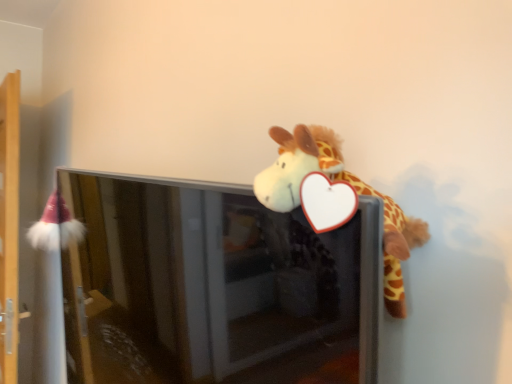
Locate an element on the screen. transparent glass screen door at upper center is located at coordinates (216, 286).

In order to face transparent glass screen door at upper center, should I rotate leftwards or rightwards?

To face it directly, rotate left by 15.056 degrees.

What do you see at coordinates (216, 286) in the screenshot? I see `transparent glass screen door at upper center` at bounding box center [216, 286].

At what (x,y) coordinates should I click in order to perform the action: click on wooden shelf at left. Please return your answer as a coordinate pair (x, y). This screenshot has height=384, width=512. Looking at the image, I should click on (9, 226).

The width and height of the screenshot is (512, 384). What do you see at coordinates (9, 226) in the screenshot? I see `wooden shelf at left` at bounding box center [9, 226].

Where is `transparent glass screen door at upper center`? The image size is (512, 384). transparent glass screen door at upper center is located at coordinates (216, 286).

Between wooden shelf at left and transparent glass screen door at upper center, which one appears on the right side from the viewer's perspective?

transparent glass screen door at upper center is more to the right.

Which is behind, wooden shelf at left or transparent glass screen door at upper center?

Positioned behind is wooden shelf at left.

Which is farther from the camera, (15, 342) or (312, 342)?

Point (15, 342)

From the image's perspective, is wooden shelf at left located beneath transparent glass screen door at upper center?

Actually, wooden shelf at left appears above transparent glass screen door at upper center in the image.

From a real-world perspective, who is located lower, wooden shelf at left or transparent glass screen door at upper center?

From a 3D spatial view, transparent glass screen door at upper center is below.

Considering the relative sizes of wooden shelf at left and transparent glass screen door at upper center in the image provided, is wooden shelf at left thinner than transparent glass screen door at upper center?

Correct, the width of wooden shelf at left is less than that of transparent glass screen door at upper center.

Can you confirm if wooden shelf at left is taller than transparent glass screen door at upper center?

Correct, wooden shelf at left is much taller as transparent glass screen door at upper center.

Is wooden shelf at left smaller than transparent glass screen door at upper center?

Yes.

Would you say transparent glass screen door at upper center is part of wooden shelf at left's contents?

No.

Does wooden shelf at left touch transparent glass screen door at upper center?

No, wooden shelf at left is not beside transparent glass screen door at upper center.

Is wooden shelf at left turned away from transparent glass screen door at upper center?

wooden shelf at left is not turned away from transparent glass screen door at upper center.

How far apart are wooden shelf at left and transparent glass screen door at upper center?

wooden shelf at left is 1.09 meters away from transparent glass screen door at upper center.

The width and height of the screenshot is (512, 384). Find the location of `screen door lying in front of the wooden shelf at left`. screen door lying in front of the wooden shelf at left is located at coordinates (216, 286).

Considering the positions of objects transparent glass screen door at upper center and wooden shelf at left in the image provided, who is more to the left, transparent glass screen door at upper center or wooden shelf at left?

wooden shelf at left.

Between transparent glass screen door at upper center and wooden shelf at left, which one is positioned in front?

transparent glass screen door at upper center is in front.

Does point (326, 375) appear closer or farther from the camera than point (16, 261)?

Point (326, 375) is positioned closer to the camera compared to point (16, 261).

From the image's perspective, does transparent glass screen door at upper center appear higher than wooden shelf at left?

No, from the image's perspective, transparent glass screen door at upper center is not above wooden shelf at left.

From a real-world perspective, which is physically above, transparent glass screen door at upper center or wooden shelf at left?

wooden shelf at left.

Between transparent glass screen door at upper center and wooden shelf at left, which one has smaller width?

Thinner between the two is wooden shelf at left.

Considering the relative sizes of transparent glass screen door at upper center and wooden shelf at left in the image provided, is transparent glass screen door at upper center shorter than wooden shelf at left?

Indeed, transparent glass screen door at upper center has a lesser height compared to wooden shelf at left.

Which of these two, transparent glass screen door at upper center or wooden shelf at left, is smaller?

wooden shelf at left.

Is wooden shelf at left completely or partially inside transparent glass screen door at upper center?

Definitely not — wooden shelf at left is not inside transparent glass screen door at upper center.

Can you see transparent glass screen door at upper center touching wooden shelf at left?

No, transparent glass screen door at upper center is not beside wooden shelf at left.

Does transparent glass screen door at upper center turn towards wooden shelf at left?

No, transparent glass screen door at upper center is not turned towards wooden shelf at left.

The width and height of the screenshot is (512, 384). In order to click on screen door that appears in front of the wooden shelf at left in this screenshot , I will do `click(216, 286)`.

Where is `screen door that appears below the wooden shelf at left (from a real-world perspective)`? The width and height of the screenshot is (512, 384). screen door that appears below the wooden shelf at left (from a real-world perspective) is located at coordinates (216, 286).

What are the coordinates of `shelf located on the left of transparent glass screen door at upper center` in the screenshot? It's located at (9, 226).